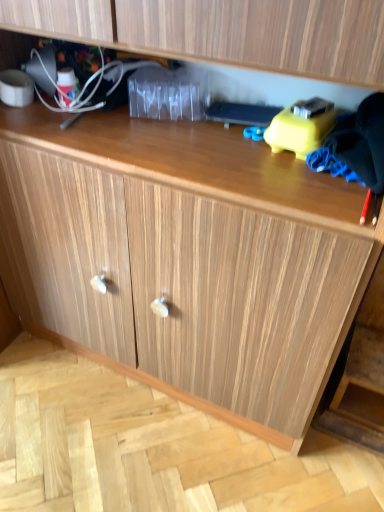
Question: Is yellow plastic toy at upper right wider than black fabric at right?

Choices:
 (A) no
 (B) yes

Answer: (A)

Question: Is yellow plastic toy at upper right far from black fabric at right?

Choices:
 (A) yes
 (B) no

Answer: (B)

Question: From the image's perspective, does yellow plastic toy at upper right appear lower than black fabric at right?

Choices:
 (A) yes
 (B) no

Answer: (B)

Question: Does yellow plastic toy at upper right have a lesser height compared to black fabric at right?

Choices:
 (A) no
 (B) yes

Answer: (B)

Question: Considering the relative sizes of yellow plastic toy at upper right and black fabric at right in the image provided, is yellow plastic toy at upper right smaller than black fabric at right?

Choices:
 (A) yes
 (B) no

Answer: (A)

Question: Is yellow plastic toy at upper right positioned behind black fabric at right?

Choices:
 (A) no
 (B) yes

Answer: (B)

Question: From a real-world perspective, is black fabric at right positioned over yellow plastic toy at upper right based on gravity?

Choices:
 (A) no
 (B) yes

Answer: (B)

Question: Does black fabric at right appear on the left side of yellow plastic toy at upper right?

Choices:
 (A) no
 (B) yes

Answer: (A)

Question: Is yellow plastic toy at upper right a part of black fabric at right?

Choices:
 (A) yes
 (B) no

Answer: (B)

Question: Considering the relative sizes of black fabric at right and yellow plastic toy at upper right in the image provided, is black fabric at right taller than yellow plastic toy at upper right?

Choices:
 (A) yes
 (B) no

Answer: (A)

Question: Is the depth of black fabric at right greater than that of yellow plastic toy at upper right?

Choices:
 (A) yes
 (B) no

Answer: (B)

Question: From the image's perspective, is black fabric at right under yellow plastic toy at upper right?

Choices:
 (A) no
 (B) yes

Answer: (B)

Question: Is black fabric at right to the left or to the right of yellow plastic toy at upper right in the image?

Choices:
 (A) left
 (B) right

Answer: (B)